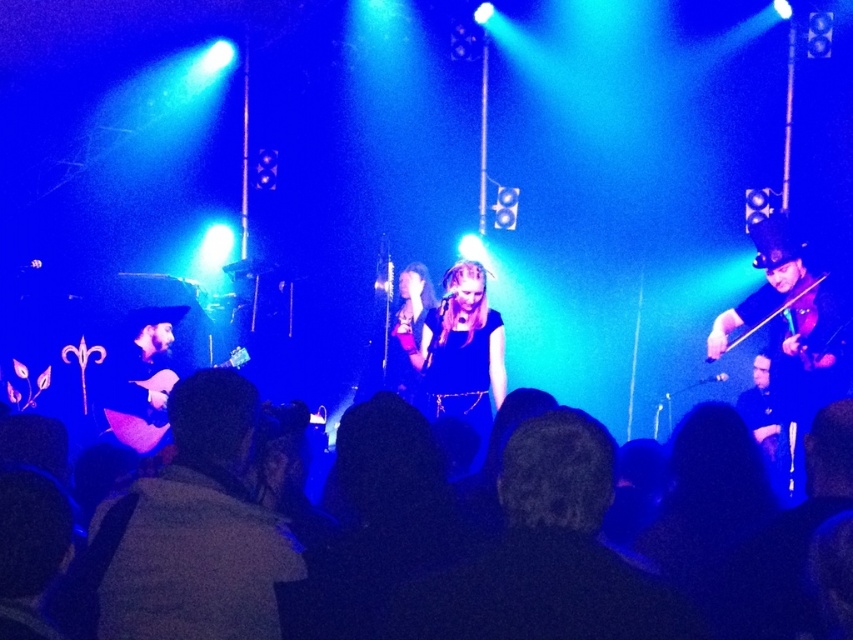
Looking at this image, which is above, shiny black violin at right or shiny purple guitar at left?

Positioned higher is shiny black violin at right.

Can you confirm if shiny black violin at right is positioned to the right of shiny purple guitar at left?

Yes, shiny black violin at right is to the right of shiny purple guitar at left.

Is point (793, 419) farther from viewer compared to point (235, 355)?

No.

You are a GUI agent. You are given a task and a screenshot of the screen. Output one action in this format:
    pyautogui.click(x=<x>, y=<y>)
    Task: Click on the shiny black violin at right
    The image size is (853, 640).
    Given the screenshot: What is the action you would take?
    pyautogui.click(x=793, y=323)

Find the location of a particular element. dark gray jacket at lower left is located at coordinates (192, 531).

Can you confirm if dark gray jacket at lower left is shorter than shiny purple guitar at left?

No.

Which is in front, point (204, 636) or point (135, 422)?

Point (204, 636)

Identify the location of dark gray jacket at lower left. (192, 531).

Does dark gray jacket at lower left lie behind shiny black violin at right?

No, dark gray jacket at lower left is closer to the viewer.

Does point (291, 554) come in front of point (804, 326)?

Yes, point (291, 554) is in front of point (804, 326).

Identify the location of dark gray jacket at lower left. The height and width of the screenshot is (640, 853). (192, 531).